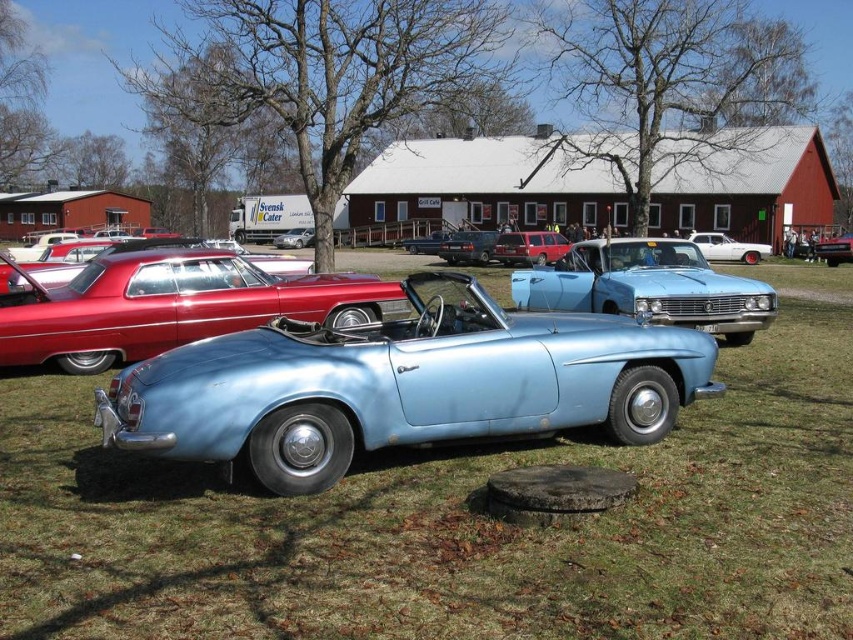
You are a photographer wanting to capture both the white glossy sedan at center and the satin black car at center in a single shot. Since you can only focus on one car at a time, which car should you focus on to ensure the other remains in the background?

You should focus on the white glossy sedan at center because the satin black car at center is behind it, so keeping the sedan in focus will leave the black car in the background.

You are standing at the entrance of the vintage car exhibition and notice two points marked in the image. The first point is at coordinates point [204,317], and the second is at point [277,240]. Which point is closer to you?

Point [204,317] is in front of point [277,240], so the first point is closer to you.

You are a photographer setting up a tripod in the middle of the light green grass at center and light blue metallic car at center. Can you place the tripod between them without it touching either object?

The light green grass at center is wider than the light blue metallic car at center, so yes, there is enough space to place the tripod between them without touching either object.